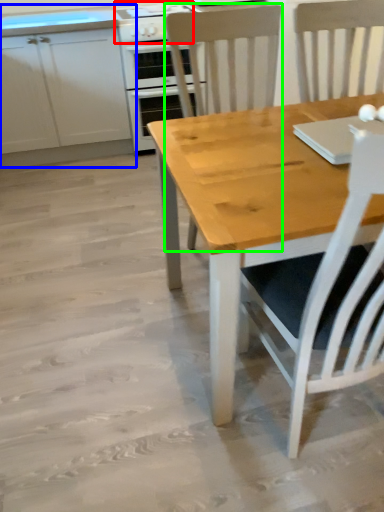
Question: Considering the real-world distances, which object is farthest from gas stove (highlighted by a red box)? cabinetry (highlighted by a blue box) or chair (highlighted by a green box)?

Choices:
 (A) cabinetry
 (B) chair

Answer: (A)